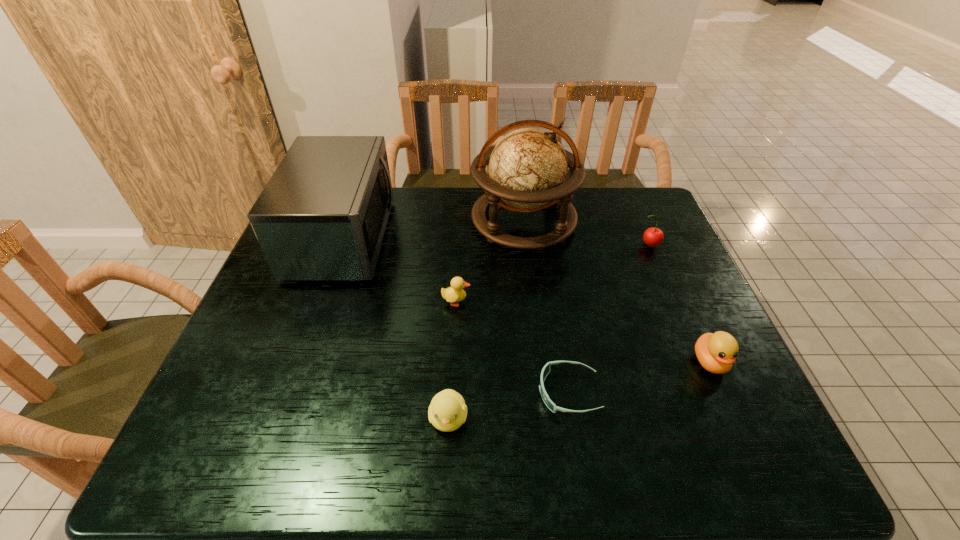
At what (x,y) coordinates should I click in order to perform the action: click on the tallest object. Please return your answer as a coordinate pair (x, y). Looking at the image, I should click on (528, 168).

Locate an element on the screen. microwave oven is located at coordinates (322, 216).

This screenshot has width=960, height=540. I want to click on the leftmost object, so click(322, 216).

Image resolution: width=960 pixels, height=540 pixels. I want to click on cherry, so click(652, 236).

The image size is (960, 540). In order to click on the second farthest duckling in this screenshot , I will do `click(716, 352)`.

Find the location of a particular element. Image resolution: width=960 pixels, height=540 pixels. the farthest duckling is located at coordinates (455, 293).

Where is `the nearest duckling`? The height and width of the screenshot is (540, 960). the nearest duckling is located at coordinates (447, 412).

Where is `goggles`? This screenshot has height=540, width=960. goggles is located at coordinates (546, 369).

Where is `free point located on the front of the globe`? free point located on the front of the globe is located at coordinates (540, 363).

Image resolution: width=960 pixels, height=540 pixels. What are the coordinates of `vacant space positioned 0.390m on the front-facing side of the second tallest object` in the screenshot? It's located at (518, 239).